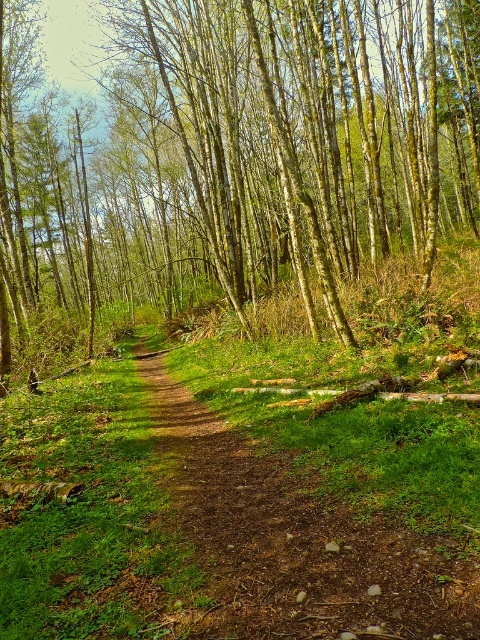
Question: Can you confirm if brown smooth tree at center is smaller than dirt path at center?

Choices:
 (A) yes
 (B) no

Answer: (B)

Question: Is brown smooth tree at center below dirt path at center?

Choices:
 (A) no
 (B) yes

Answer: (A)

Question: Which point appears closest to the camera in this image?

Choices:
 (A) (264, 588)
 (B) (62, 147)

Answer: (A)

Question: Is brown smooth tree at center bigger than dirt path at center?

Choices:
 (A) no
 (B) yes

Answer: (B)